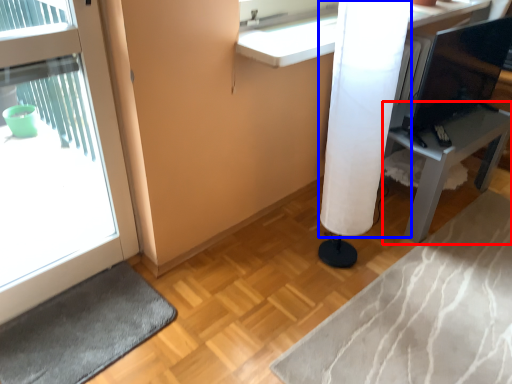
Question: Which of the following is the farthest to the observer, furniture (highlighted by a red box) or shower curtain (highlighted by a blue box)?

Choices:
 (A) furniture
 (B) shower curtain

Answer: (A)